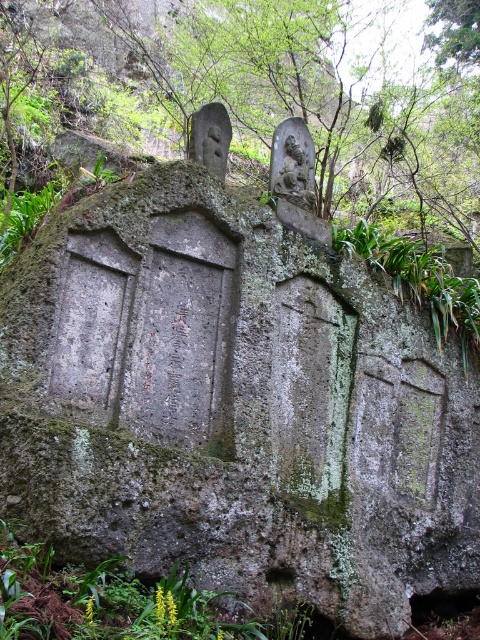
Question: Considering the real-world distances, which object is closest to the green mossy rock at center?

Choices:
 (A) carved stone statue at center
 (B) green leafy plants at lower left

Answer: (A)

Question: Can you confirm if green leafy plants at lower left is smaller than carved stone statue at center?

Choices:
 (A) yes
 (B) no

Answer: (B)

Question: Can you confirm if green mossy rock at center is positioned below carved stone statue at center?

Choices:
 (A) no
 (B) yes

Answer: (A)

Question: Among these points, which one is nearest to the camera?

Choices:
 (A) (377, 173)
 (B) (309, 193)

Answer: (B)

Question: Does green mossy rock at center appear on the right side of carved stone statue at center?

Choices:
 (A) no
 (B) yes

Answer: (A)

Question: Based on their relative distances, which object is nearer to the green mossy rock at center?

Choices:
 (A) carved stone statue at center
 (B) green leafy plants at lower left

Answer: (A)